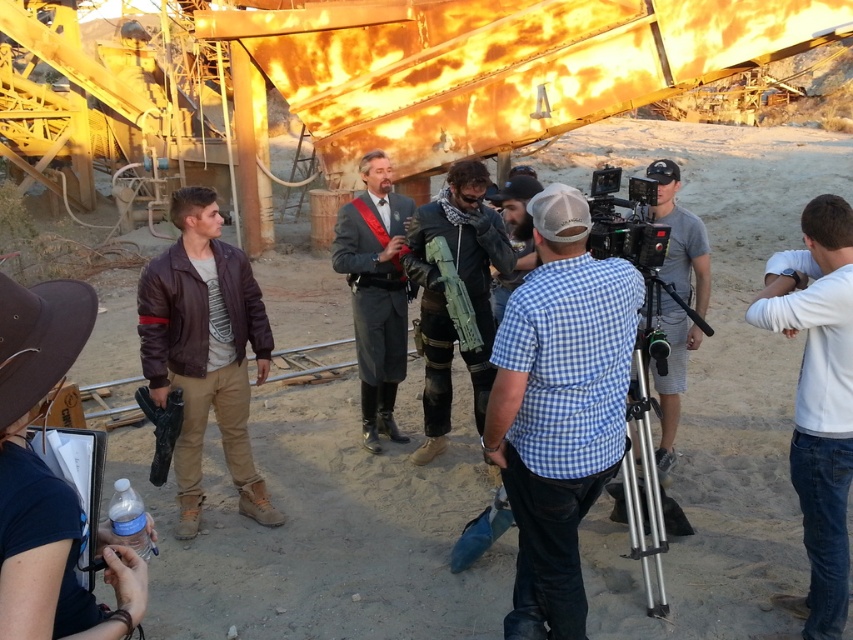
Can you confirm if brown leather jacket at left is bigger than black plastic video camera at center?

Correct, brown leather jacket at left is larger in size than black plastic video camera at center.

Is brown leather jacket at left shorter than black plastic video camera at center?

Incorrect, brown leather jacket at left's height does not fall short of black plastic video camera at center's.

This screenshot has width=853, height=640. What are the coordinates of `brown leather jacket at left` in the screenshot? It's located at (206, 349).

Does white cotton shirt at right have a lesser width compared to gray wool suit at center?

Correct, white cotton shirt at right's width is less than gray wool suit at center's.

Is white cotton shirt at right to the right of gray wool suit at center from the viewer's perspective?

Yes, white cotton shirt at right is to the right of gray wool suit at center.

Who is more distant from viewer, (848, 451) or (399, 205)?

The point (399, 205) is more distant.

At what (x,y) coordinates should I click in order to perform the action: click on white cotton shirt at right. Please return your answer as a coordinate pair (x, y). This screenshot has height=640, width=853. Looking at the image, I should click on (817, 401).

Does brown leather jacket at lower left have a lesser width compared to silver metallic tripod at center?

Correct, brown leather jacket at lower left's width is less than silver metallic tripod at center's.

Which is more to the right, brown leather jacket at lower left or silver metallic tripod at center?

silver metallic tripod at center

Find the location of a particular element. The image size is (853, 640). brown leather jacket at lower left is located at coordinates (48, 481).

Where is `brown leather jacket at lower left`? brown leather jacket at lower left is located at coordinates (48, 481).